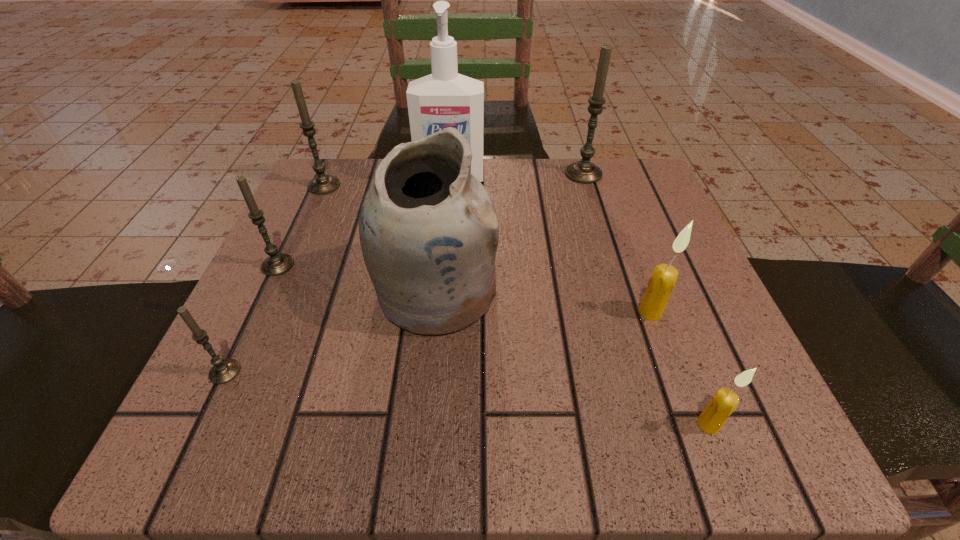
At what (x,y) coordinates should I click in order to perform the action: click on empty space that is in between the nearest gray candle and the third nearest candle. Please return your answer as a coordinate pair (x, y). Looking at the image, I should click on (438, 342).

Locate an element on the screen. object identified as the closest to the fifth shortest candle is located at coordinates (443, 99).

I want to click on object that is the fifth closest to the third farthest candle, so click(x=584, y=171).

The height and width of the screenshot is (540, 960). I want to click on candle that stands as the second closest to the third farthest gray candle, so click(322, 184).

Locate which candle is the closest to the pottery. Please provide its 2D coordinates. Your answer should be formatted as a tuple, i.e. [(x, y)], where the tuple contains the x and y coordinates of a point satisfying the conditions above.

[(276, 264)]

Locate an element on the screen. The width and height of the screenshot is (960, 540). gray candle identified as the third closest to the pottery is located at coordinates (322, 184).

Select which gray candle is the closest to the nearest candle. Please provide its 2D coordinates. Your answer should be formatted as a tuple, i.e. [(x, y)], where the tuple contains the x and y coordinates of a point satisfying the conditions above.

[(584, 171)]

Image resolution: width=960 pixels, height=540 pixels. What are the coordinates of `free spot that satisfies the following two spatial constraints: 1. on the front side of the nearest candle; 2. on the right side of the tallest candle` in the screenshot? It's located at (660, 424).

Image resolution: width=960 pixels, height=540 pixels. Identify the location of free spot that satisfies the following two spatial constraints: 1. on the front side of the smallest gray candle; 2. on the left side of the nearer cream candle. (200, 424).

Image resolution: width=960 pixels, height=540 pixels. In order to click on vacant position in the image that satisfies the following two spatial constraints: 1. on the back side of the third farthest gray candle; 2. on the right side of the tallest candle in this screenshot , I will do `click(321, 174)`.